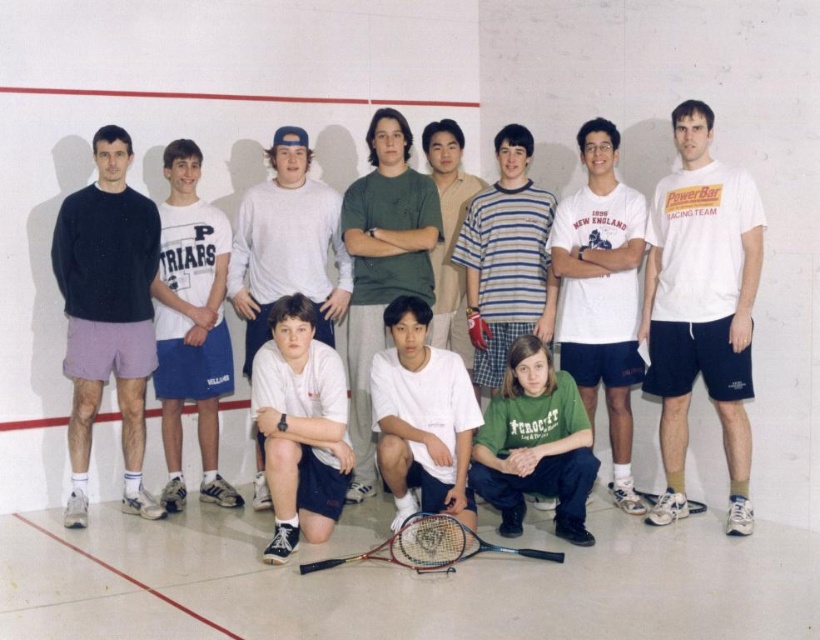
Question: Which object is positioned closest to the white cotton shirt at center?

Choices:
 (A) striped cotton shirt at center
 (B) metallic gold tennis racket at center
 (C) green cotton shirt at center

Answer: (C)

Question: Can you confirm if green cotton shirt at center is bigger than striped cotton shirt at center?

Choices:
 (A) yes
 (B) no

Answer: (A)

Question: Among these objects, which one is nearest to the camera?

Choices:
 (A) dark blue sweater at left
 (B) white matte t-shirt at center
 (C) green matte shirt at center
 (D) white cotton shirt at left

Answer: (B)

Question: Which point is closer to the camera?

Choices:
 (A) (187, 148)
 (B) (581, 419)
 (C) (413, 536)
 (D) (99, 202)

Answer: (C)

Question: Can you confirm if white cotton t-shirt at right is positioned to the left of white cotton t-shirt at center?

Choices:
 (A) yes
 (B) no

Answer: (B)

Question: Can you confirm if white cotton shirt at center is positioned to the right of striped cotton shirt at center?

Choices:
 (A) yes
 (B) no

Answer: (B)